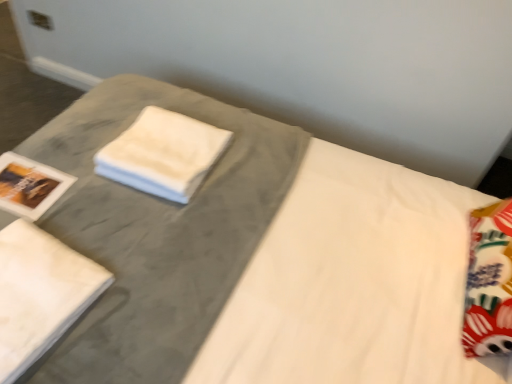
I want to click on free location above white cotton bath towel at lower left (from a real-world perspective), so click(32, 279).